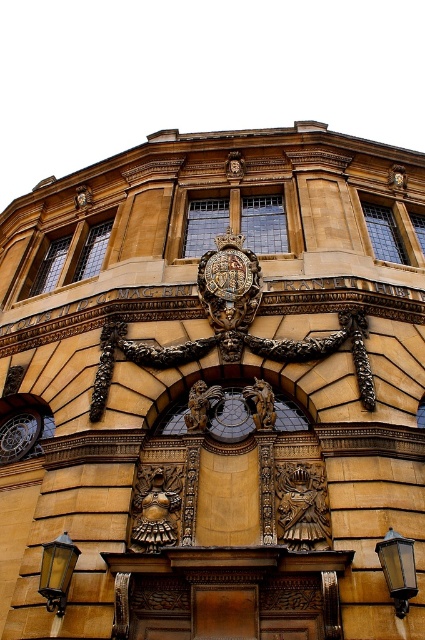
You are an architect examining this historic building and notice the matte gold lamp at lower left and the gold textured clock at center. Which object has a greater height?

The matte gold lamp at lower left is taller than the gold textured clock at center according to the description.

You are an interior designer tasked with arranging a new chandelier in this historic building. You have two options for placement based on the existing objects. The first option is to place it near the metallic glass lamp at lower right, and the second is near the gold textured clock at center. Considering the scale of the existing objects, which location would allow the chandelier to be more proportional in size?

The metallic glass lamp at lower right is bigger than the gold textured clock at center. Therefore, placing the chandelier near the metallic glass lamp at lower right would ensure better proportionality since the chandelier can be larger to match the scale of the existing object.

You are an interior designer planning to place a new rectangular table between the matte gold lamp at lower left and the gold textured clock at center. The table is 1.2 meters wide. Can the table fit between them without touching either object?

The matte gold lamp at lower left might be wider than the gold textured clock at center, so there is uncertainty about the available space. To ensure safety, measure the distance between them before placing the table.